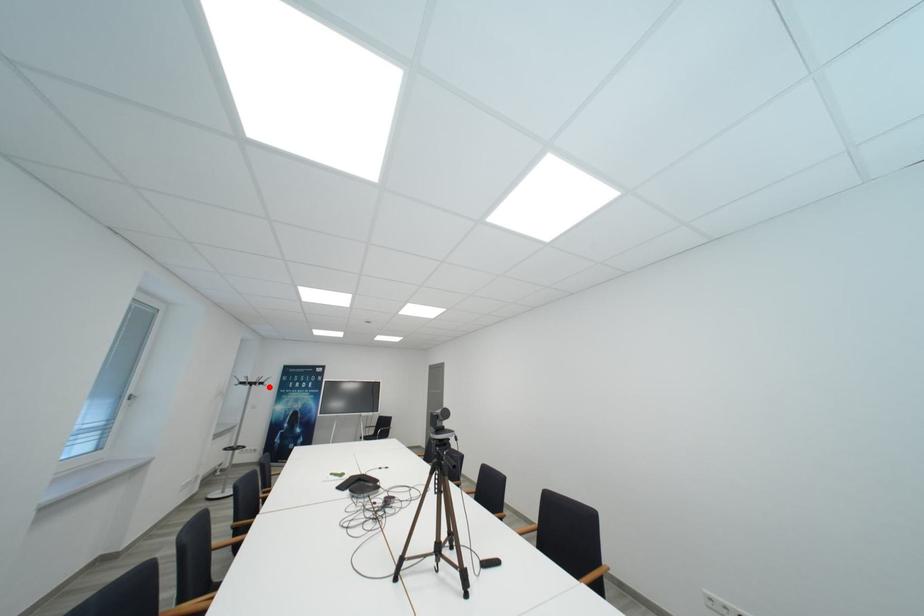
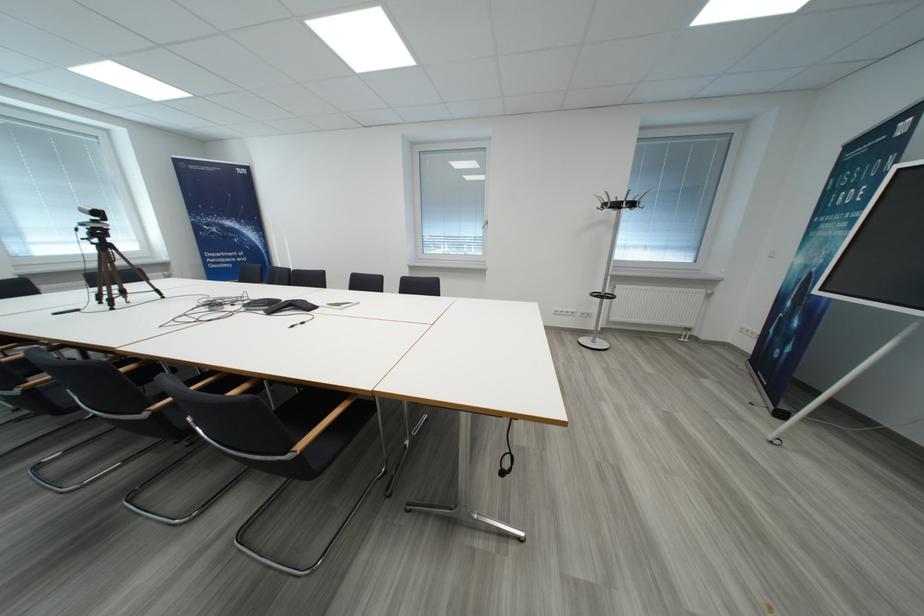
Question: I am providing you with two images of the same scene from different viewpoints. In image1, a red point is highlighted. Considering the same 3D point in image2, which of the following is correct?

Choices:
 (A) It is closer
 (B) It is farther

Answer: (A)